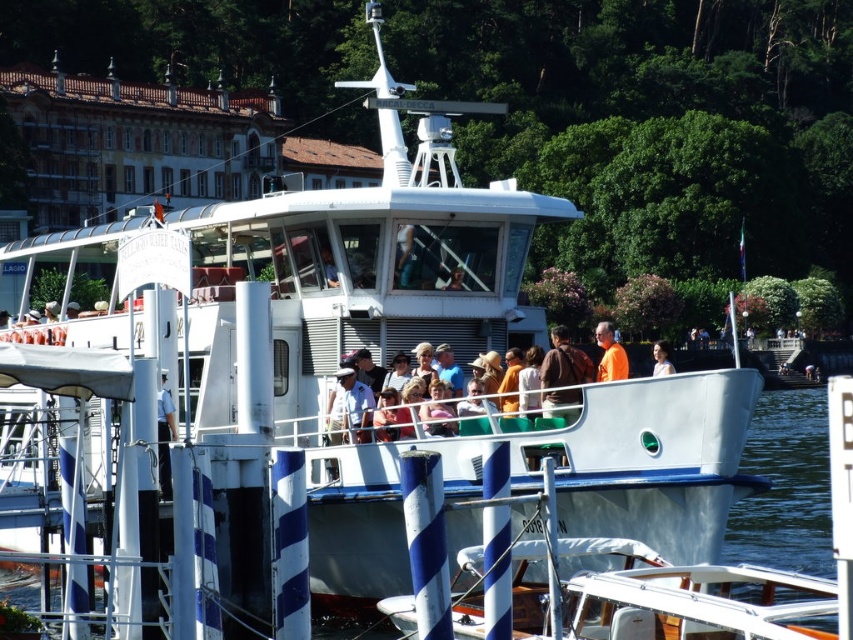
Question: Which point appears farthest from the camera in this image?

Choices:
 (A) (602, 358)
 (B) (165, 460)
 (C) (663, 364)
 (D) (549, 358)

Answer: (A)

Question: Does orange fabric shirt at center appear on the left side of matte orange shirt at center?

Choices:
 (A) no
 (B) yes

Answer: (B)

Question: Does brown leather jacket at center have a smaller size compared to light blue uniform at center?

Choices:
 (A) yes
 (B) no

Answer: (B)

Question: Which point is closer to the camera?

Choices:
 (A) (601, 328)
 (B) (546, 394)
 (C) (170, 401)
 (D) (665, 346)

Answer: (B)

Question: Which point appears farthest from the camera in this image?

Choices:
 (A) (653, 364)
 (B) (567, 336)
 (C) (596, 374)
 (D) (160, 394)

Answer: (A)

Question: Does brown leather jacket at center appear on the left side of matte orange shirt at center?

Choices:
 (A) no
 (B) yes

Answer: (B)